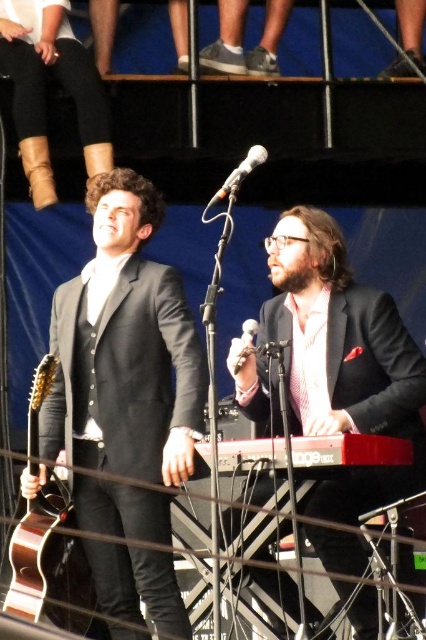
You are a photographer setting up for a concert. You need to ensure that the matte black suit at left and the metallic silver microphone at center are both visible in your shot. Given that the camera frame can only accommodate objects up to the width of the wider of the two, which object determines the minimum required frame width?

The matte black suit at left is wider than the metallic silver microphone at center, so the minimum required frame width must accommodate the width of the matte black suit at left.

You are a photographer taking a picture of the stage. The metallic keyboard at center is represented by point (350, 451). Where should you focus your camera to capture the metallic keyboard at center?

You should focus your camera at point (350, 451) to capture the metallic keyboard at center.

You are a photographer at the back of the venue and want to capture a clear shot of both the matte black suit at left and the metallic silver microphone at center. Based on their positions, which object is closer to the camera?

The matte black suit at left is positioned under the metallic silver microphone at center, so the microphone is closer to the camera.